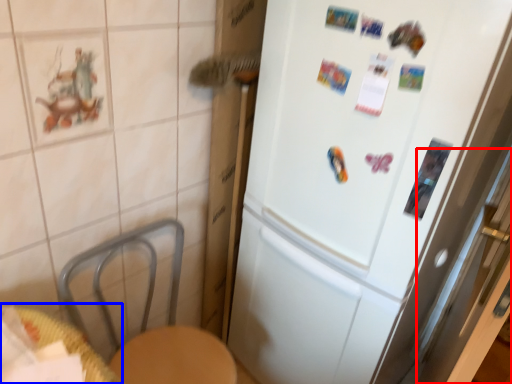
Question: Which object appears farthest to the camera in this image, screen door (highlighted by a red box) or table (highlighted by a blue box)?

Choices:
 (A) screen door
 (B) table

Answer: (A)